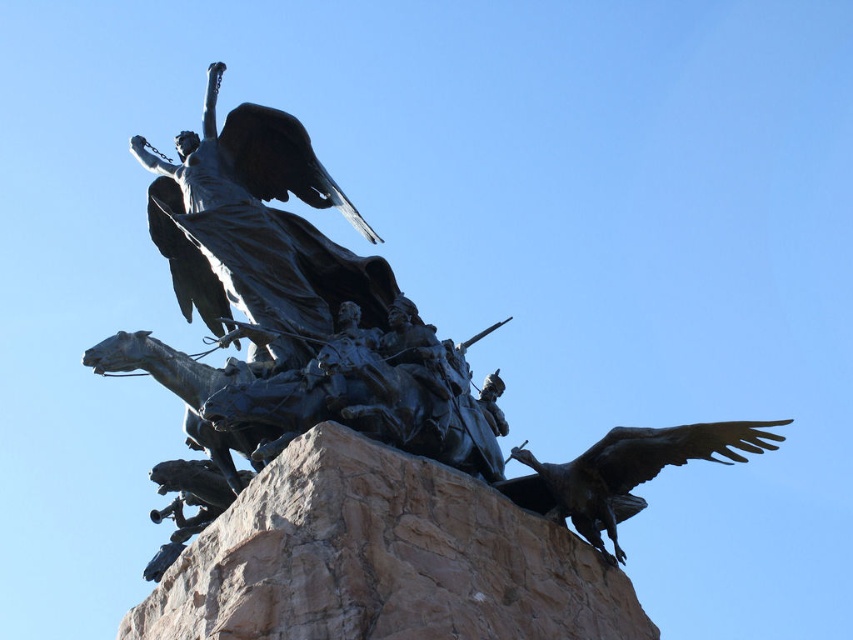
From the picture: You are an art conservator examining the sculpture and its pedestal. You need to clean the brown rough stone at center and the bronze statue at center. Which object should you clean first if you want to start with the one that is farther from your current position?

The brown rough stone at center is behind the bronze statue at center, so you should clean the bronze statue at center first since it is closer to you.

You are an art conservator assessing the stability of the sculpture. The brown rough stone at center is part of the pedestal, and the bronze eagle at lower right is part of the base. Considering their heights, which object might require additional support to prevent toppling?

The bronze eagle at lower right might require additional support because it is much shorter than the brown rough stone at center, making it potentially less stable.